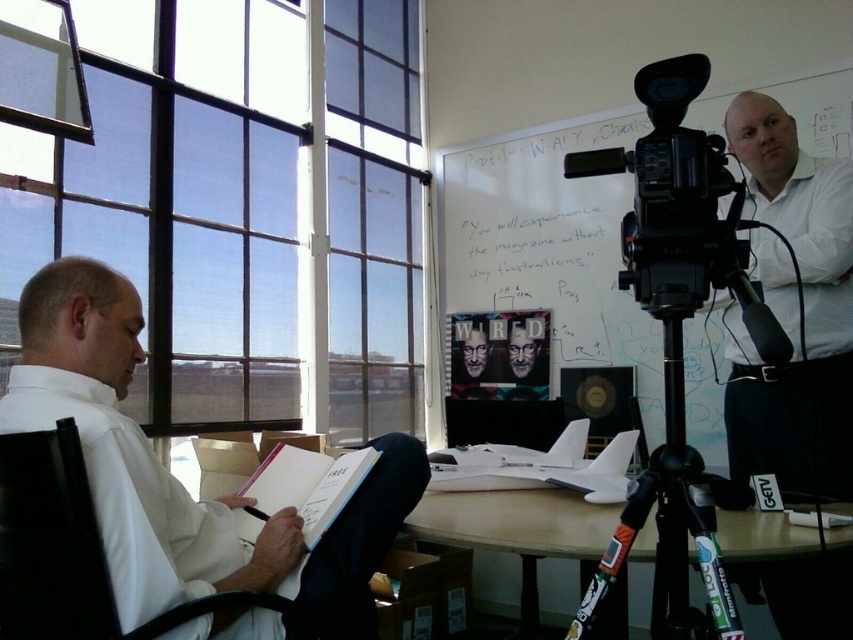
Describe the element at coordinates (548, 241) in the screenshot. This screenshot has height=640, width=853. I see `whiteboard at upper right` at that location.

Between whiteboard at upper right and hardcover book at lower center, which one is positioned higher?

whiteboard at upper right is higher up.

Image resolution: width=853 pixels, height=640 pixels. I want to click on whiteboard at upper right, so click(x=548, y=241).

I want to click on whiteboard at upper right, so [x=548, y=241].

Between white shirt at left and whiteboard at upper right, which one appears on the left side from the viewer's perspective?

white shirt at left

Based on the photo, does white shirt at left have a lesser width compared to whiteboard at upper right?

Yes.

Where is `white shirt at left`? The width and height of the screenshot is (853, 640). white shirt at left is located at coordinates (129, 449).

The width and height of the screenshot is (853, 640). Find the location of `white shirt at left`. white shirt at left is located at coordinates (129, 449).

Which is above, white shirt at left or matte black glasses at center?

matte black glasses at center

Based on the photo, between white shirt at left and matte black glasses at center, which one has more height?

white shirt at left is taller.

Describe the element at coordinates (129, 449) in the screenshot. I see `white shirt at left` at that location.

Find the location of a particular element. white shirt at left is located at coordinates (129, 449).